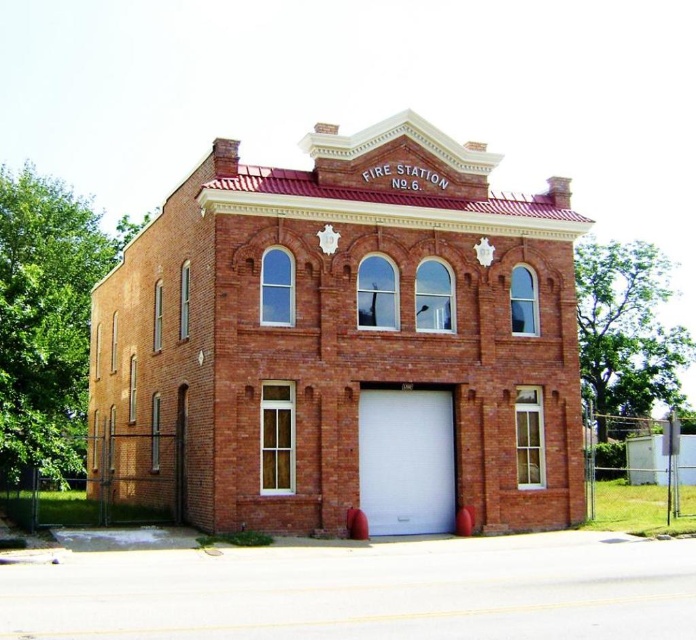
Question: Is red brick fire station at center smaller than white matte garage door at center?

Choices:
 (A) no
 (B) yes

Answer: (A)

Question: Does red brick fire station at center have a greater width compared to white matte garage door at center?

Choices:
 (A) yes
 (B) no

Answer: (A)

Question: Which point is farther from the camera taking this photo?

Choices:
 (A) (435, 509)
 (B) (287, 525)

Answer: (A)

Question: Among these points, which one is nearest to the camera?

Choices:
 (A) (390, 426)
 (B) (223, 202)

Answer: (B)

Question: Is red brick fire station at center to the right of white matte garage door at center from the viewer's perspective?

Choices:
 (A) no
 (B) yes

Answer: (A)